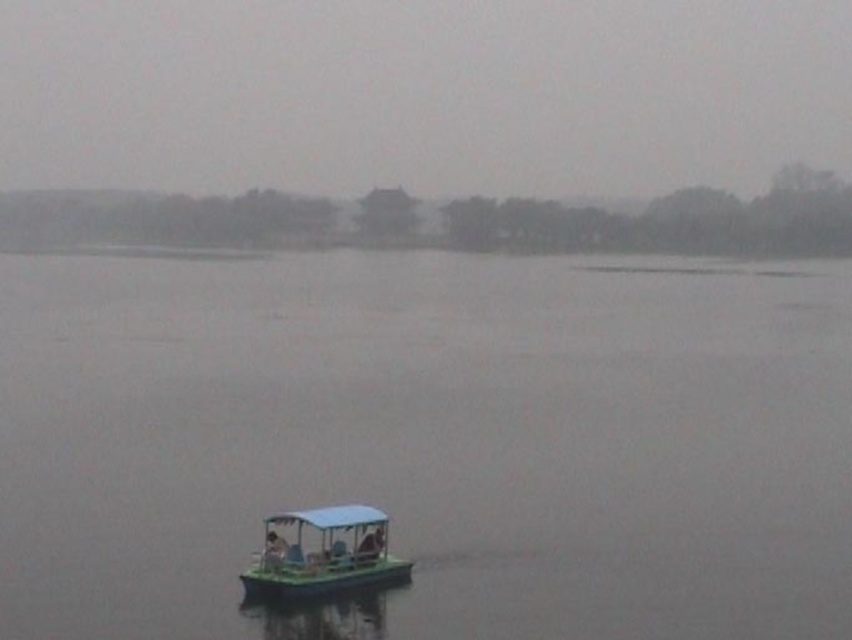
Question: Which object appears farthest from the camera in this image?

Choices:
 (A) green plastic boat at lower center
 (B) green plastic boat at center

Answer: (A)

Question: Does green plastic boat at center have a lesser width compared to green plastic boat at lower center?

Choices:
 (A) yes
 (B) no

Answer: (B)

Question: Which point is farther to the camera?

Choices:
 (A) (281, 541)
 (B) (758, 497)

Answer: (B)

Question: From the image, what is the correct spatial relationship of green plastic boat at center in relation to green plastic boat at lower center?

Choices:
 (A) right
 (B) left

Answer: (B)

Question: Is green plastic boat at center above green plastic boat at lower center?

Choices:
 (A) yes
 (B) no

Answer: (A)